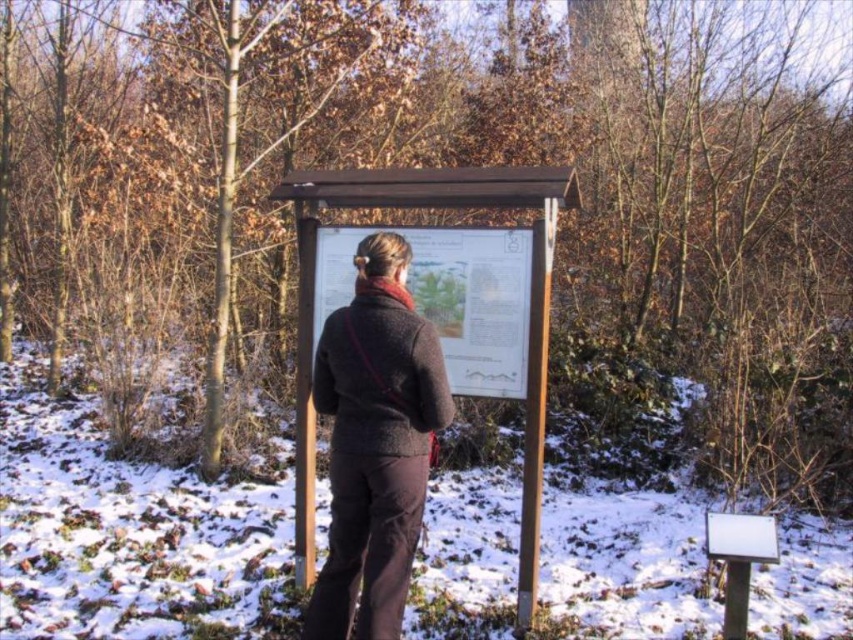
Question: Which point is closer to the camera?

Choices:
 (A) white powdery snow at center
 (B) wooden sign at center
 (C) brown woolen sweater at center

Answer: (C)

Question: Does wooden sign at center have a lesser width compared to brown woolen sweater at center?

Choices:
 (A) yes
 (B) no

Answer: (B)

Question: Which of the following is the closest to the observer?

Choices:
 (A) white powdery snow at center
 (B) brown woolen sweater at center

Answer: (B)

Question: Which point is farther to the camera?

Choices:
 (A) white powdery snow at center
 (B) wooden sign at center
 (C) brown woolen sweater at center

Answer: (A)

Question: Can you confirm if white powdery snow at center is positioned above brown woolen sweater at center?

Choices:
 (A) yes
 (B) no

Answer: (B)

Question: Does white powdery snow at center appear over brown woolen sweater at center?

Choices:
 (A) no
 (B) yes

Answer: (A)